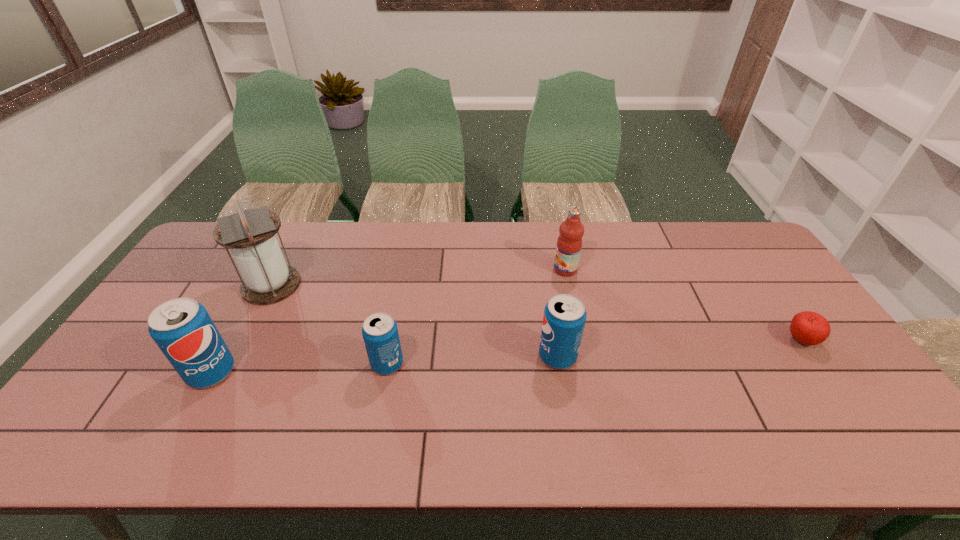
Locate an element on the screen. vacant region between the rightmost object and the tallest object is located at coordinates (x=536, y=313).

Where is `empty space that is in between the apple and the shortest soda can`? The height and width of the screenshot is (540, 960). empty space that is in between the apple and the shortest soda can is located at coordinates (594, 352).

Identify the location of vacant space in between the leftmost soda can and the rightmost object. This screenshot has width=960, height=540. (506, 356).

Find the location of a particular element. This screenshot has width=960, height=540. vacant region between the second shortest soda can and the lantern is located at coordinates (415, 321).

Identify the location of object that is the closest to the leftmost soda can. (267, 279).

Select which object is the fourth closest to the rightmost soda can. Please provide its 2D coordinates. Your answer should be formatted as a tuple, i.e. [(x, y)], where the tuple contains the x and y coordinates of a point satisfying the conditions above.

[(267, 279)]

Identify which soda can is the second closest to the shortest object. Please provide its 2D coordinates. Your answer should be formatted as a tuple, i.e. [(x, y)], where the tuple contains the x and y coordinates of a point satisfying the conditions above.

[(380, 333)]

At what (x,y) coordinates should I click in order to perform the action: click on soda can that is the second nearest to the rightmost soda can. Please return your answer as a coordinate pair (x, y). Looking at the image, I should click on coord(182,328).

Where is `vacant space that satisfies the following two spatial constraints: 1. on the back side of the rightmost soda can; 2. on the right side of the rightmost object`? The image size is (960, 540). vacant space that satisfies the following two spatial constraints: 1. on the back side of the rightmost soda can; 2. on the right side of the rightmost object is located at coordinates (555, 341).

I want to click on vacant space that satisfies the following two spatial constraints: 1. on the back side of the rightmost soda can; 2. on the right side of the leftmost soda can, so click(220, 356).